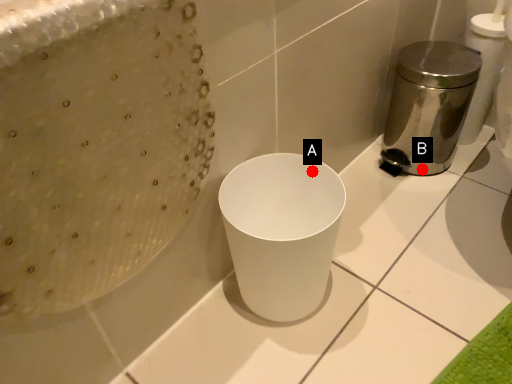
Question: Two points are circled on the image, labeled by A and B beside each circle. Which point is closer to the camera?

Choices:
 (A) A is closer
 (B) B is closer

Answer: (A)